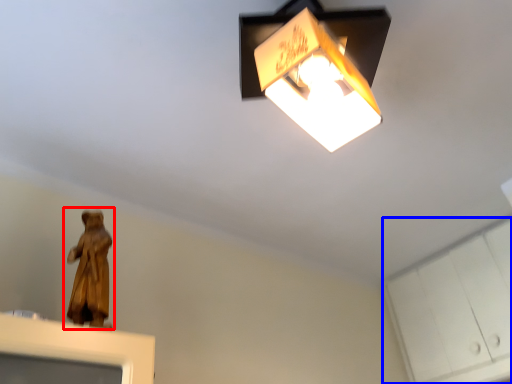
Question: Among these objects, which one is farthest to the camera, person (highlighted by a red box) or cabinetry (highlighted by a blue box)?

Choices:
 (A) person
 (B) cabinetry

Answer: (B)